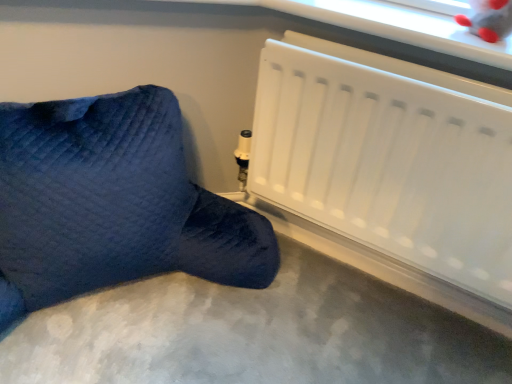
Question: Visually, is white matte radiator at lower right positioned to the left or to the right of velvety blue bean bag at lower left?

Choices:
 (A) right
 (B) left

Answer: (A)

Question: Looking at their shapes, would you say white matte radiator at lower right is wider or thinner than velvety blue bean bag at lower left?

Choices:
 (A) wide
 (B) thin

Answer: (B)

Question: Which is farther from the velvety blue bean bag at lower left?

Choices:
 (A) white matte radiator at lower right
 (B) smooth gray carpet at lower center

Answer: (A)

Question: Which object is the farthest from the velvety blue bean bag at lower left?

Choices:
 (A) smooth gray carpet at lower center
 (B) white matte radiator at lower right

Answer: (B)